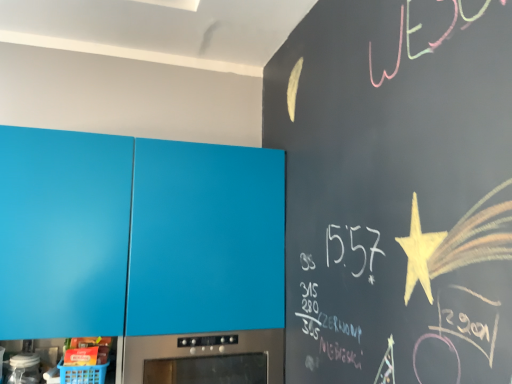
Question: Are satin silver oven at lower center and matte blue cabinet at left making contact?

Choices:
 (A) yes
 (B) no

Answer: (B)

Question: Considering the relative positions of satin silver oven at lower center and matte blue cabinet at left in the image provided, is satin silver oven at lower center to the right of matte blue cabinet at left from the viewer's perspective?

Choices:
 (A) yes
 (B) no

Answer: (A)

Question: Is satin silver oven at lower center shorter than matte blue cabinet at left?

Choices:
 (A) yes
 (B) no

Answer: (A)

Question: Is satin silver oven at lower center located outside matte blue cabinet at left?

Choices:
 (A) yes
 (B) no

Answer: (B)

Question: Considering the relative sizes of satin silver oven at lower center and matte blue cabinet at left in the image provided, is satin silver oven at lower center bigger than matte blue cabinet at left?

Choices:
 (A) no
 (B) yes

Answer: (A)

Question: Is the position of satin silver oven at lower center more distant than that of matte blue cabinet at left?

Choices:
 (A) yes
 (B) no

Answer: (A)

Question: Is matte blue cabinet at left shorter than satin silver oven at lower center?

Choices:
 (A) no
 (B) yes

Answer: (A)

Question: From a real-world perspective, is matte blue cabinet at left positioned over satin silver oven at lower center based on gravity?

Choices:
 (A) no
 (B) yes

Answer: (B)

Question: From a real-world perspective, is matte blue cabinet at left located beneath satin silver oven at lower center?

Choices:
 (A) no
 (B) yes

Answer: (A)

Question: Can you confirm if matte blue cabinet at left is bigger than satin silver oven at lower center?

Choices:
 (A) yes
 (B) no

Answer: (A)

Question: Is matte blue cabinet at left wider than satin silver oven at lower center?

Choices:
 (A) no
 (B) yes

Answer: (A)

Question: From the image's perspective, does matte blue cabinet at left appear higher than satin silver oven at lower center?

Choices:
 (A) no
 (B) yes

Answer: (B)

Question: From the image's perspective, is matte blue cabinet at left located above or below satin silver oven at lower center?

Choices:
 (A) below
 (B) above

Answer: (B)